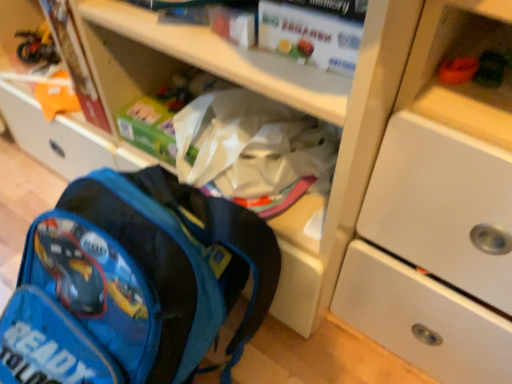
Question: Does matte cardboard book at upper left, which ranks as the first paperback book in back-to-front order, have a smaller size compared to blue fabric backpack at lower left?

Choices:
 (A) no
 (B) yes

Answer: (B)

Question: Can we say matte cardboard book at upper left, acting as the first paperback book starting from the left, lies outside blue fabric backpack at lower left?

Choices:
 (A) yes
 (B) no

Answer: (A)

Question: Can you confirm if matte cardboard book at upper left, which ranks as the first paperback book in back-to-front order, is taller than blue fabric backpack at lower left?

Choices:
 (A) no
 (B) yes

Answer: (A)

Question: Is the position of matte cardboard book at upper left, marked as the 2th paperback book in a front-to-back arrangement, less distant than that of blue fabric backpack at lower left?

Choices:
 (A) no
 (B) yes

Answer: (A)

Question: Does matte cardboard book at upper left, which ranks as the first paperback book in back-to-front order, lie behind blue fabric backpack at lower left?

Choices:
 (A) no
 (B) yes

Answer: (B)

Question: Does matte cardboard book at upper left, the second paperback book viewed from the right, appear on the right side of blue fabric backpack at lower left?

Choices:
 (A) yes
 (B) no

Answer: (B)

Question: Is blue fabric backpack at lower left positioned with its back to white matte paper at upper center, arranged as the 2th paperback book when viewed from the back?

Choices:
 (A) no
 (B) yes

Answer: (A)

Question: Can you confirm if blue fabric backpack at lower left is shorter than white matte paper at upper center, arranged as the 2th paperback book when viewed from the back?

Choices:
 (A) no
 (B) yes

Answer: (A)

Question: Is blue fabric backpack at lower left not inside white matte paper at upper center, arranged as the 2th paperback book when viewed from the back?

Choices:
 (A) no
 (B) yes

Answer: (B)

Question: From the image's perspective, is blue fabric backpack at lower left below white matte paper at upper center, the 1th paperback book from the right?

Choices:
 (A) no
 (B) yes

Answer: (B)

Question: Can you confirm if blue fabric backpack at lower left is positioned to the right of white matte paper at upper center, the 1th paperback book from the right?

Choices:
 (A) yes
 (B) no

Answer: (B)

Question: Is blue fabric backpack at lower left oriented towards white matte paper at upper center, arranged as the 2th paperback book when viewed from the back?

Choices:
 (A) no
 (B) yes

Answer: (A)

Question: Does blue fabric backpack at lower left come behind matte cardboard book at upper left, acting as the first paperback book starting from the left?

Choices:
 (A) yes
 (B) no

Answer: (B)